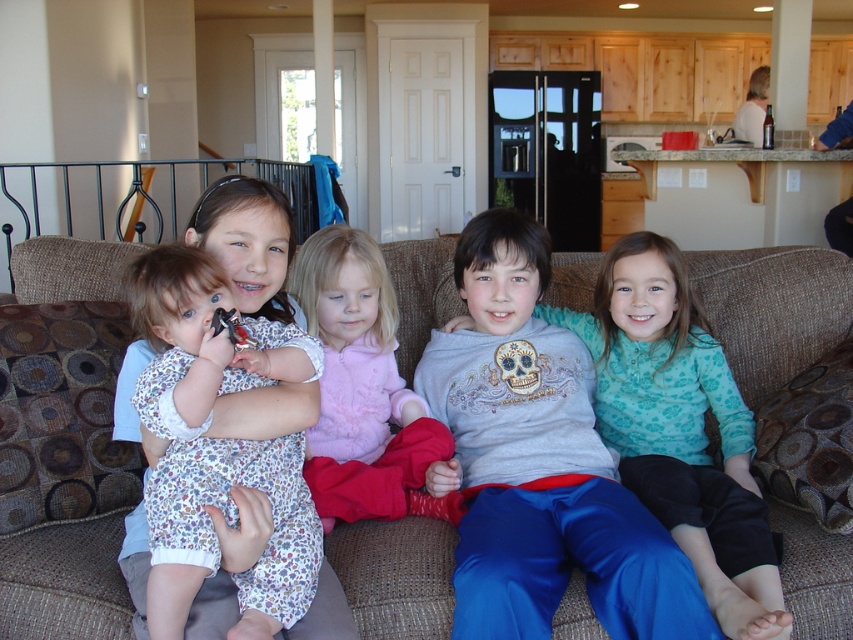
Looking at this image, who is positioned more to the right, matte gray sweatshirt at center or floral dress at center?

matte gray sweatshirt at center

Is point (521, 429) behind point (299, 448)?

That is True.

You are a GUI agent. You are given a task and a screenshot of the screen. Output one action in this format:
    pyautogui.click(x=<x>, y=<y>)
    Task: Click on the matte gray sweatshirt at center
    The image size is (853, 640).
    Given the screenshot: What is the action you would take?
    pyautogui.click(x=538, y=461)

Does brown fabric couch at center appear under matte gray sweatshirt at center?

No, brown fabric couch at center is not below matte gray sweatshirt at center.

Between point (7, 588) and point (473, 589), which one is positioned in front?

Point (473, 589)

This screenshot has width=853, height=640. In order to click on brown fabric couch at center in this screenshot , I will do (x=773, y=308).

Does matte gray sweatshirt at center have a greater height compared to fluffy pink sweater at center?

Correct, matte gray sweatshirt at center is much taller as fluffy pink sweater at center.

Who is higher up, matte gray sweatshirt at center or fluffy pink sweater at center?

fluffy pink sweater at center is higher up.

Is point (703, 637) positioned before point (302, 262)?

Yes, point (703, 637) is closer to viewer.

The width and height of the screenshot is (853, 640). What are the coordinates of `matte gray sweatshirt at center` in the screenshot? It's located at (538, 461).